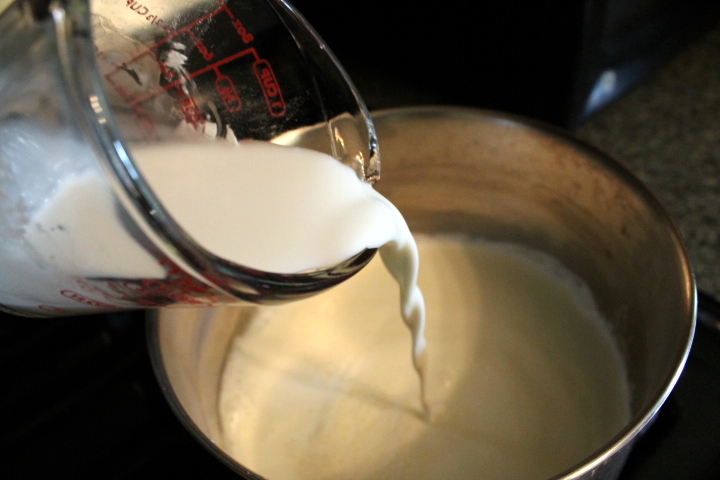
The width and height of the screenshot is (720, 480). Identify the location of glass. (310, 117).